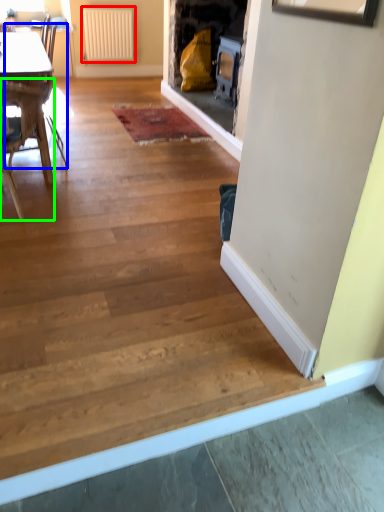
Question: Which is nearer to the radiator (highlighted by a red box)? armchair (highlighted by a blue box) or chair (highlighted by a green box).

Choices:
 (A) armchair
 (B) chair

Answer: (A)